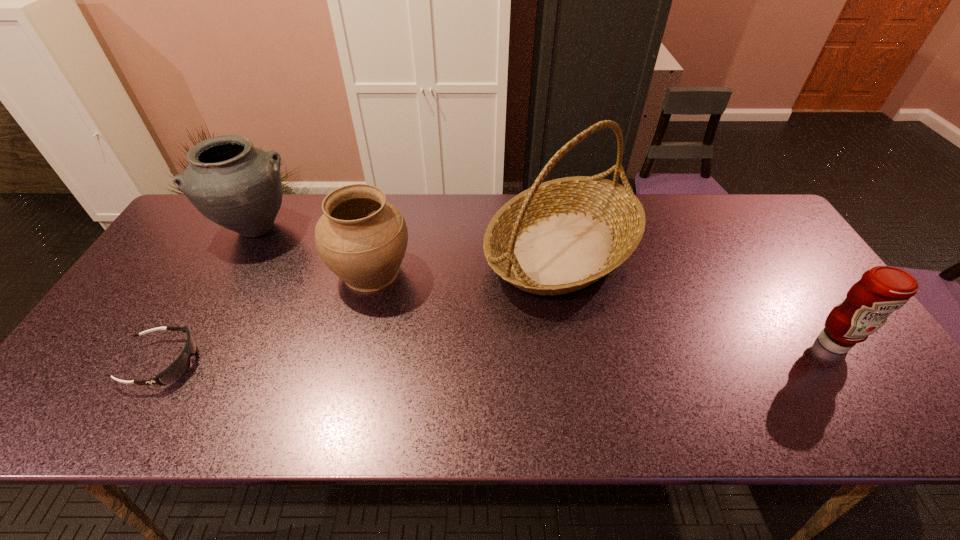
Locate an element on the screen. This screenshot has width=960, height=540. the third closest object to the left urn is located at coordinates (557, 237).

Where is `object that is the second closest to the rightmost object`? object that is the second closest to the rightmost object is located at coordinates (362, 238).

At what (x,y) coordinates should I click in order to perform the action: click on free space that satisfies the following two spatial constraints: 1. on the front side of the basket; 2. on the left side of the rightmost object. Please return your answer as a coordinate pair (x, y). Looking at the image, I should click on (581, 343).